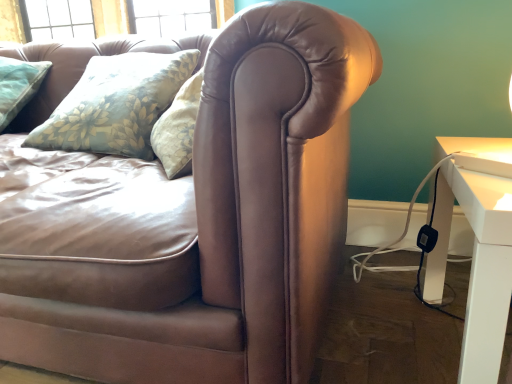
Question: Could you tell me if brown leather couch at center is facing white glossy table at right?

Choices:
 (A) yes
 (B) no

Answer: (B)

Question: From the image's perspective, is brown leather couch at center above white glossy table at right?

Choices:
 (A) no
 (B) yes

Answer: (B)

Question: Is brown leather couch at center outside of white glossy table at right?

Choices:
 (A) yes
 (B) no

Answer: (A)

Question: From a real-world perspective, does brown leather couch at center sit lower than white glossy table at right?

Choices:
 (A) no
 (B) yes

Answer: (A)

Question: From the image's perspective, would you say brown leather couch at center is shown under white glossy table at right?

Choices:
 (A) yes
 (B) no

Answer: (B)

Question: Would you say brown leather couch at center is a long distance from white glossy table at right?

Choices:
 (A) yes
 (B) no

Answer: (B)

Question: Does white glossy table at right have a greater width compared to brown leather couch at center?

Choices:
 (A) no
 (B) yes

Answer: (A)

Question: Is white glossy table at right to the right of brown leather couch at center from the viewer's perspective?

Choices:
 (A) no
 (B) yes

Answer: (B)

Question: From the image's perspective, is white glossy table at right under brown leather couch at center?

Choices:
 (A) yes
 (B) no

Answer: (A)

Question: Are white glossy table at right and brown leather couch at center located far from each other?

Choices:
 (A) yes
 (B) no

Answer: (B)

Question: From a real-world perspective, is white glossy table at right physically above brown leather couch at center?

Choices:
 (A) no
 (B) yes

Answer: (A)

Question: Is brown leather couch at center at the back of white glossy table at right?

Choices:
 (A) no
 (B) yes

Answer: (B)

Question: Considering the positions of point (488, 332) and point (267, 273), is point (488, 332) closer or farther from the camera than point (267, 273)?

Choices:
 (A) closer
 (B) farther

Answer: (B)